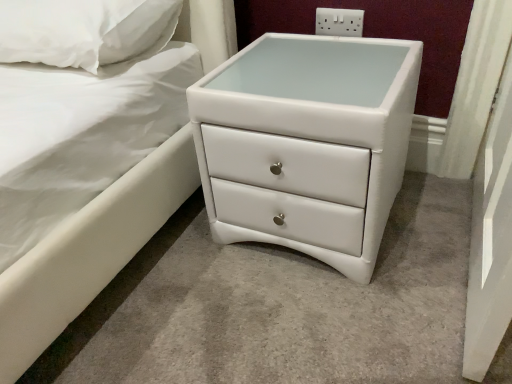
Question: Considering the relative sizes of white plastic electrical outlet at upper center and white glossy chest of drawers at lower right in the image provided, is white plastic electrical outlet at upper center wider than white glossy chest of drawers at lower right?

Choices:
 (A) no
 (B) yes

Answer: (A)

Question: Considering the relative positions of white plastic electrical outlet at upper center and white glossy chest of drawers at lower right in the image provided, is white plastic electrical outlet at upper center to the left of white glossy chest of drawers at lower right from the viewer's perspective?

Choices:
 (A) no
 (B) yes

Answer: (A)

Question: Would you say white plastic electrical outlet at upper center is a long distance from white glossy chest of drawers at lower right?

Choices:
 (A) yes
 (B) no

Answer: (B)

Question: Does white plastic electrical outlet at upper center have a larger size compared to white glossy chest of drawers at lower right?

Choices:
 (A) no
 (B) yes

Answer: (A)

Question: Is white glossy chest of drawers at lower right at the back of white plastic electrical outlet at upper center?

Choices:
 (A) no
 (B) yes

Answer: (A)

Question: Can you confirm if white plastic electrical outlet at upper center is taller than white glossy chest of drawers at lower right?

Choices:
 (A) yes
 (B) no

Answer: (B)

Question: Is white soft pillow at upper left positioned with its back to white plastic electrical outlet at upper center?

Choices:
 (A) no
 (B) yes

Answer: (A)

Question: From the image's perspective, is white soft pillow at upper left located above white plastic electrical outlet at upper center?

Choices:
 (A) no
 (B) yes

Answer: (A)

Question: Is white soft pillow at upper left next to white plastic electrical outlet at upper center and touching it?

Choices:
 (A) yes
 (B) no

Answer: (B)

Question: Considering the relative positions of white soft pillow at upper left and white plastic electrical outlet at upper center in the image provided, is white soft pillow at upper left to the right of white plastic electrical outlet at upper center from the viewer's perspective?

Choices:
 (A) no
 (B) yes

Answer: (A)

Question: Can you confirm if white soft pillow at upper left is smaller than white plastic electrical outlet at upper center?

Choices:
 (A) no
 (B) yes

Answer: (A)

Question: Is white soft pillow at upper left thinner than white plastic electrical outlet at upper center?

Choices:
 (A) yes
 (B) no

Answer: (B)

Question: Can you confirm if white glossy chest of drawers at lower right is thinner than white soft pillow at upper left?

Choices:
 (A) no
 (B) yes

Answer: (A)